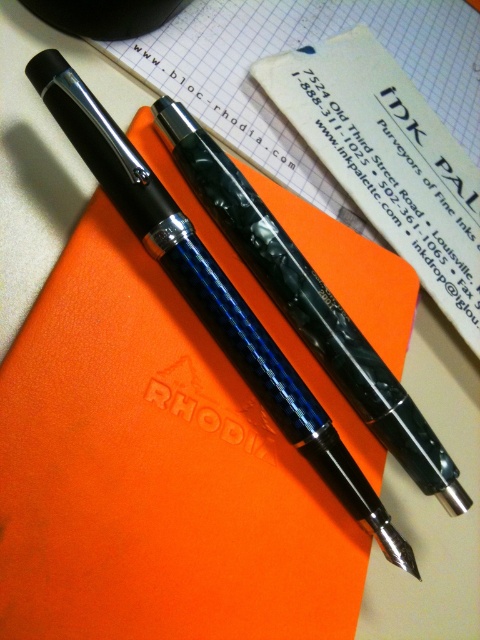
Question: Does glossy blue pen at center appear under glossy black pen at center?

Choices:
 (A) no
 (B) yes

Answer: (B)

Question: Does glossy blue pen at center appear on the left side of glossy black pen at center?

Choices:
 (A) no
 (B) yes

Answer: (B)

Question: Which point is closer to the camera taking this photo?

Choices:
 (A) (379, 365)
 (B) (320, 406)

Answer: (B)

Question: From the image, what is the correct spatial relationship of glossy blue pen at center in relation to glossy black pen at center?

Choices:
 (A) below
 (B) above

Answer: (A)